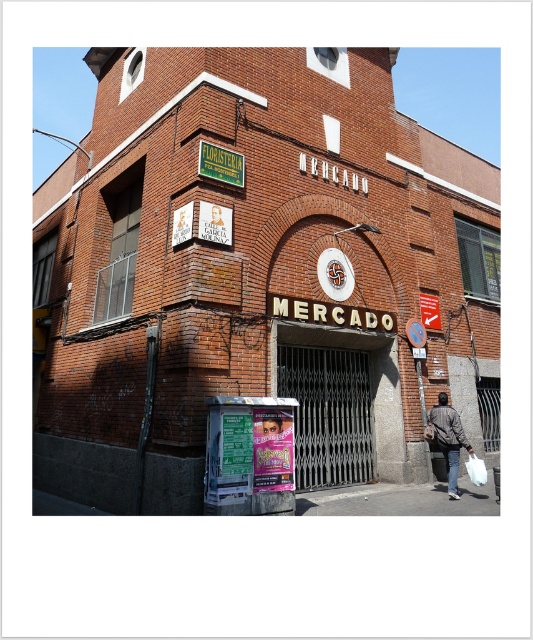
The width and height of the screenshot is (533, 640). What do you see at coordinates (257, 273) in the screenshot?
I see `brick building at center` at bounding box center [257, 273].

Between point (197, 404) and point (292, 492), which one is positioned behind?

The point (197, 404) is behind.

The width and height of the screenshot is (533, 640). What do you see at coordinates (257, 273) in the screenshot?
I see `brick building at center` at bounding box center [257, 273].

I want to click on brick building at center, so click(x=257, y=273).